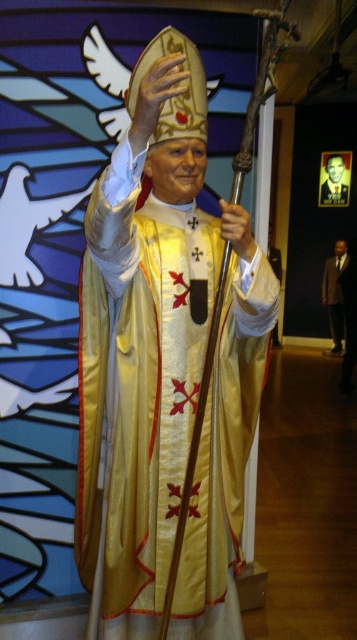
Question: Which of the following is the closest to the observer?

Choices:
 (A) white matte hand at center
 (B) gold textured robe at center
 (C) dark brown suit at right
 (D) smooth gold hand at upper center

Answer: (D)

Question: Where is gold satin robe at center located in relation to gold textured robe at center in the image?

Choices:
 (A) below
 (B) above

Answer: (A)

Question: Which of the following is the closest to the observer?

Choices:
 (A) (242, 253)
 (B) (330, 176)

Answer: (A)

Question: Is gold satin robe at center smaller than smooth gold hand at upper center?

Choices:
 (A) no
 (B) yes

Answer: (A)

Question: Which object is the closest to the dark brown suit at right?

Choices:
 (A) gold textured robe at center
 (B) gold satin robe at center
 (C) smooth gold hand at upper center
 (D) white matte hand at center

Answer: (A)

Question: Observing the image, what is the correct spatial positioning of gold textured robe at center in reference to white matte hand at center?

Choices:
 (A) left
 (B) right

Answer: (B)